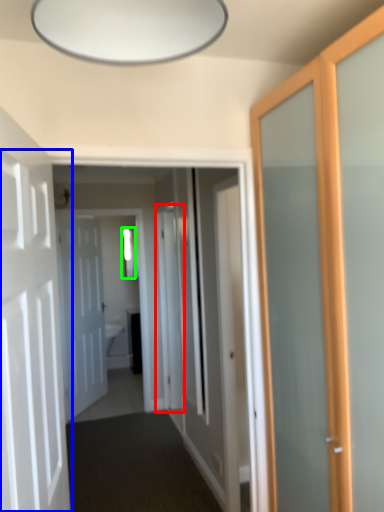
Question: Considering the real-world distances, which object is farthest from screen door (highlighted by a red box)? door (highlighted by a blue box) or window (highlighted by a green box)?

Choices:
 (A) door
 (B) window

Answer: (A)